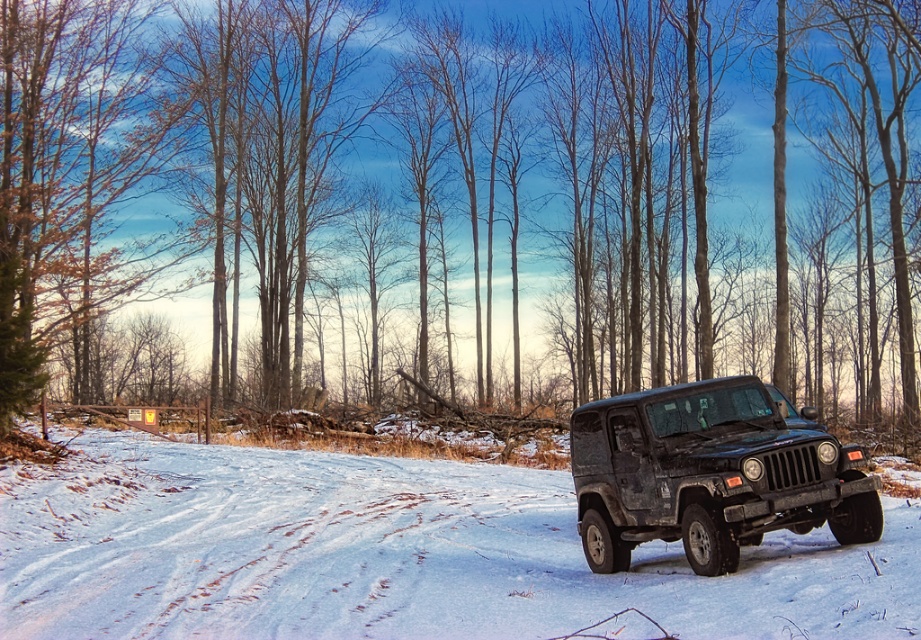
Looking at this image, who is shorter, smooth bark tree at center or white powdery snow at center?

With less height is white powdery snow at center.

Between smooth bark tree at center and white powdery snow at center, which one is positioned higher?

Positioned higher is smooth bark tree at center.

The image size is (921, 640). What do you see at coordinates (458, 202) in the screenshot? I see `smooth bark tree at center` at bounding box center [458, 202].

The width and height of the screenshot is (921, 640). What are the coordinates of `smooth bark tree at center` in the screenshot? It's located at (458, 202).

Between smooth bark tree at center and matte black jeep at center, which one has less height?

matte black jeep at center

Can you confirm if smooth bark tree at center is positioned below matte black jeep at center?

No.

Which is in front, point (863, 26) or point (801, 509)?

Point (801, 509) is in front.

The height and width of the screenshot is (640, 921). What are the coordinates of `smooth bark tree at center` in the screenshot? It's located at (458, 202).

Is point (432, 616) closer to camera compared to point (749, 476)?

That is True.

Which is behind, point (740, 627) or point (589, 461)?

Point (589, 461)

Which is behind, point (362, 589) or point (697, 532)?

The point (362, 589) is behind.

Image resolution: width=921 pixels, height=640 pixels. In order to click on white powdery snow at center in this screenshot , I will do (388, 554).